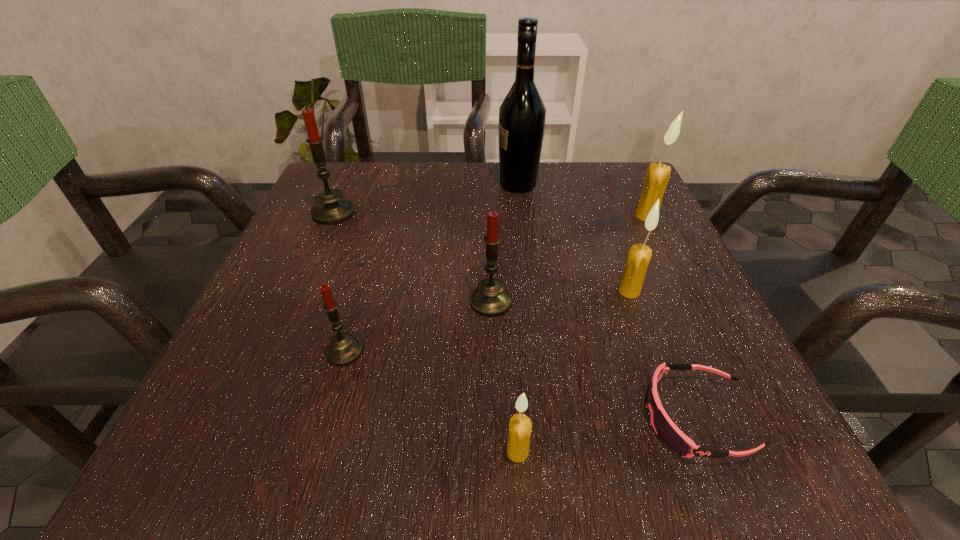
Where is `free spot between the rightmost candle and the pink goggles`? The image size is (960, 540). free spot between the rightmost candle and the pink goggles is located at coordinates (671, 316).

You are a GUI agent. You are given a task and a screenshot of the screen. Output one action in this format:
    pyautogui.click(x=<x>, y=<y>)
    Task: Click on the object that can be found as the seventh closest to the wine bottle
    
    Given the screenshot: What is the action you would take?
    pyautogui.click(x=520, y=427)

Where is `object that stands as the closest to the fifth farthest candle`? object that stands as the closest to the fifth farthest candle is located at coordinates (490, 299).

Identify the location of candle that is the fifth closest to the third nearest object. (655, 183).

The image size is (960, 540). Identify the location of candle that is the second closest to the sixth farthest object. (520, 427).

This screenshot has height=540, width=960. Find the location of `the third closest red candle to the second candle from right to left`. the third closest red candle to the second candle from right to left is located at coordinates (331, 209).

This screenshot has height=540, width=960. Find the location of `red candle that can be found as the closest to the seventh object from right to left`. red candle that can be found as the closest to the seventh object from right to left is located at coordinates (490, 299).

The image size is (960, 540). What are the coordinates of `the third closest cream candle relative to the goggles` in the screenshot? It's located at [655, 183].

You are a GUI agent. You are given a task and a screenshot of the screen. Output one action in this format:
    pyautogui.click(x=<x>, y=<y>)
    Task: Click on the cream candle object that ranks as the third closest to the tallest object
    The image size is (960, 540).
    Given the screenshot: What is the action you would take?
    pyautogui.click(x=520, y=427)

At what (x,y) coordinates should I click in order to perform the action: click on vacant space that satisfies the following two spatial constraints: 1. on the label of the wine bottle; 2. on the back side of the rightmost cream candle. Please return your answer as a coordinate pair (x, y). This screenshot has height=540, width=960. Looking at the image, I should click on (522, 216).